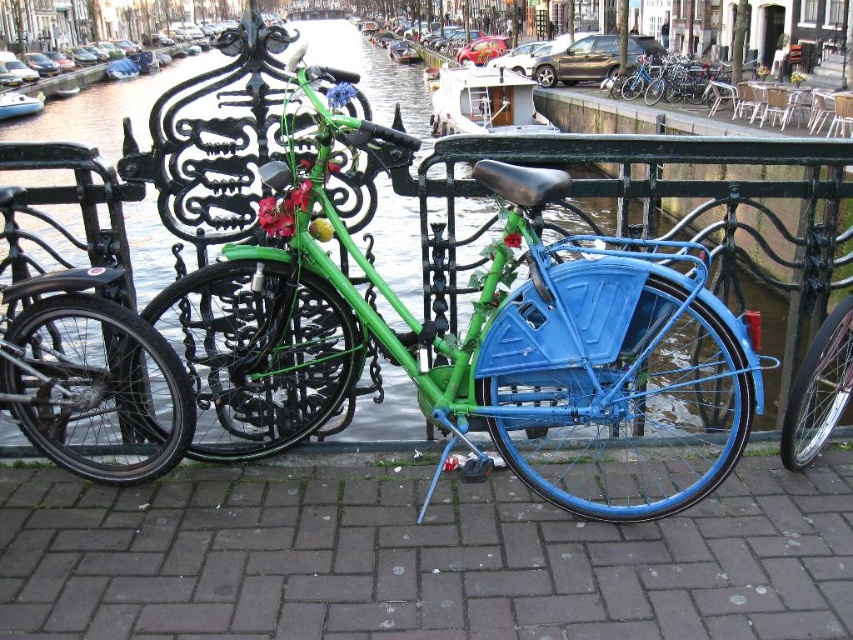
You are standing at the entrance of the canal path and want to reach the blue rubber pavement at center. Which direction should you walk from your current position?

The blue rubber pavement at center is located at point (418, 557), so you should walk towards the right and slightly forward to reach it.

You are a tourist in the city and want to take a photo of the blue rubber pavement at center and the shiny black bicycle at left. Which object is higher in the image?

The blue rubber pavement at center is taller than the shiny black bicycle at left, so the blue rubber pavement at center appears higher in the image.

You are a delivery person trying to park your bike on the blue rubber pavement at center. Can you park your bike there if there is already a blue metallic bicycle at center parked on it?

The blue rubber pavement at center is below the blue metallic bicycle at center, meaning the bicycle is currently occupying the pavement. Therefore, you cannot park your bike there until the blue metallic bicycle at center is moved.